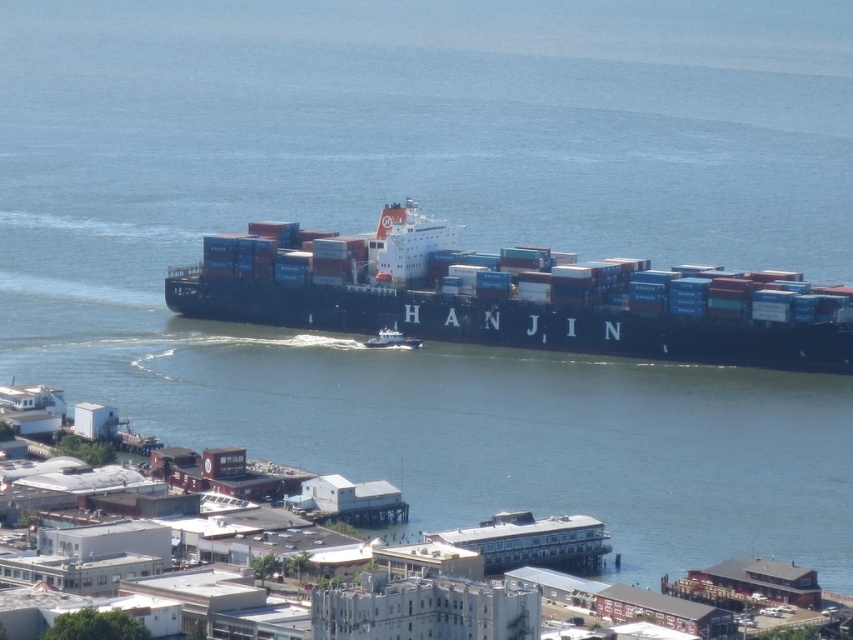
Question: Which point is farther to the camera?

Choices:
 (A) (397, 344)
 (B) (518, 298)

Answer: (B)

Question: Considering the relative positions of blue matte container ship at center and white glossy boat at center in the image provided, where is blue matte container ship at center located with respect to white glossy boat at center?

Choices:
 (A) below
 (B) above

Answer: (B)

Question: Is blue matte container ship at center thinner than white glossy boat at center?

Choices:
 (A) yes
 (B) no

Answer: (B)

Question: Which of the following is the farthest from the observer?

Choices:
 (A) (381, 337)
 (B) (807, 348)

Answer: (B)

Question: In this image, where is blue matte container ship at center located relative to white glossy boat at center?

Choices:
 (A) right
 (B) left

Answer: (A)

Question: Which object appears farthest from the camera in this image?

Choices:
 (A) blue matte container ship at center
 (B) white glossy boat at center

Answer: (B)